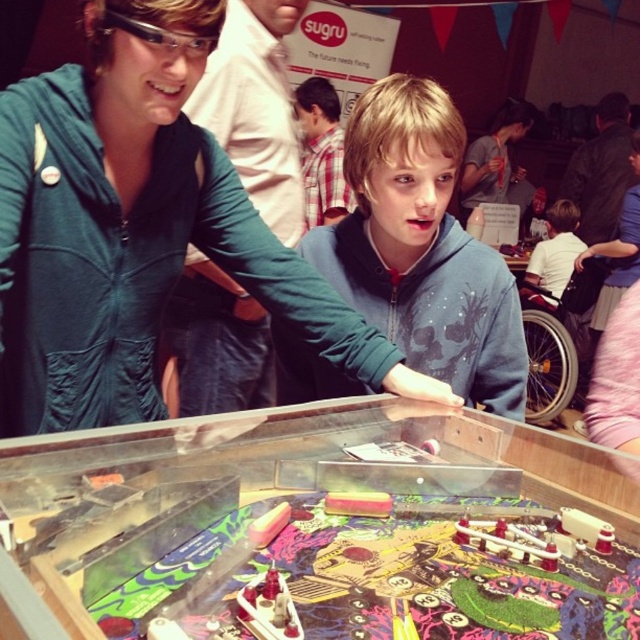
Does green matte jacket at upper left come in front of plaid shirt at center?

Yes, green matte jacket at upper left is closer to the viewer.

Measure the distance between green matte jacket at upper left and plaid shirt at center.

The distance of green matte jacket at upper left from plaid shirt at center is 1.25 meters.

Does point (282, 220) come in front of point (314, 214)?

Yes, it is.

This screenshot has width=640, height=640. I want to click on green matte jacket at upper left, so click(257, 108).

Can you confirm if green matte jacket at upper left is bigger than matte black hoodie at center?

Incorrect, green matte jacket at upper left is not larger than matte black hoodie at center.

Describe the element at coordinates (257, 108) in the screenshot. I see `green matte jacket at upper left` at that location.

Does point (196, 381) lie behind point (483, 189)?

No.

This screenshot has width=640, height=640. In order to click on green matte jacket at upper left in this screenshot , I will do `click(257, 108)`.

Does blue fleece hoodie at center have a lesser width compared to green matte jacket at upper left?

In fact, blue fleece hoodie at center might be wider than green matte jacket at upper left.

Who is more distant from viewer, [353,220] or [243,67]?

The point [243,67] is behind.

Where is `blue fleece hoodie at center`? blue fleece hoodie at center is located at coordinates (420, 248).